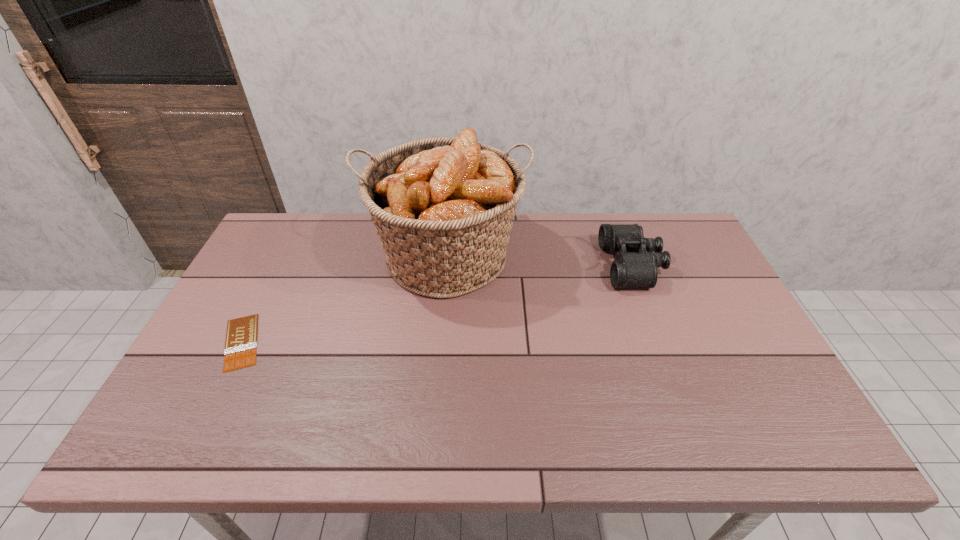
The width and height of the screenshot is (960, 540). What are the coordinates of `the closest object to the leftmost object` in the screenshot? It's located at (443, 208).

Identify which object is located as the second nearest to the tallest object. Please provide its 2D coordinates. Your answer should be formatted as a tuple, i.e. [(x, y)], where the tuple contains the x and y coordinates of a point satisfying the conditions above.

[(635, 265)]